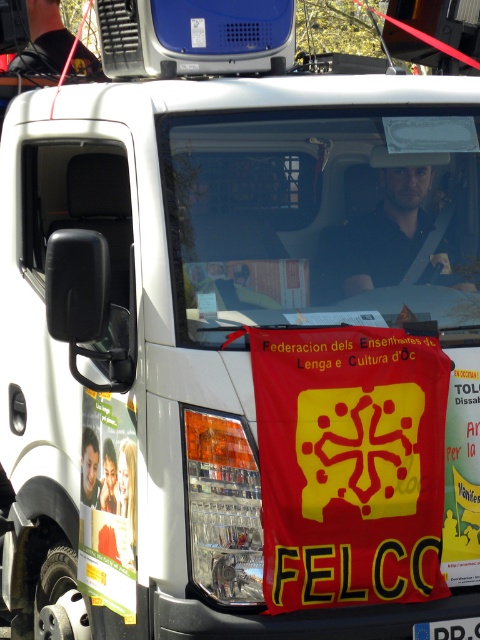
Question: From the image, what is the correct spatial relationship of dark blue shirt at center in relation to blue plastic license plate at center?

Choices:
 (A) below
 (B) above

Answer: (B)

Question: Does blue plastic speaker at upper center have a greater width compared to black fabric at upper center?

Choices:
 (A) yes
 (B) no

Answer: (A)

Question: Among these objects, which one is nearest to the camera?

Choices:
 (A) blue plastic speaker at upper center
 (B) blue plastic license plate at center

Answer: (B)

Question: Which of the following is the closest to the observer?

Choices:
 (A) (450, 627)
 (B) (360, 172)

Answer: (A)

Question: Which point is closer to the camera?

Choices:
 (A) blue plastic speaker at upper center
 (B) dark blue shirt at center

Answer: (B)

Question: Can you confirm if blue plastic speaker at upper center is smaller than black fabric at upper center?

Choices:
 (A) no
 (B) yes

Answer: (B)